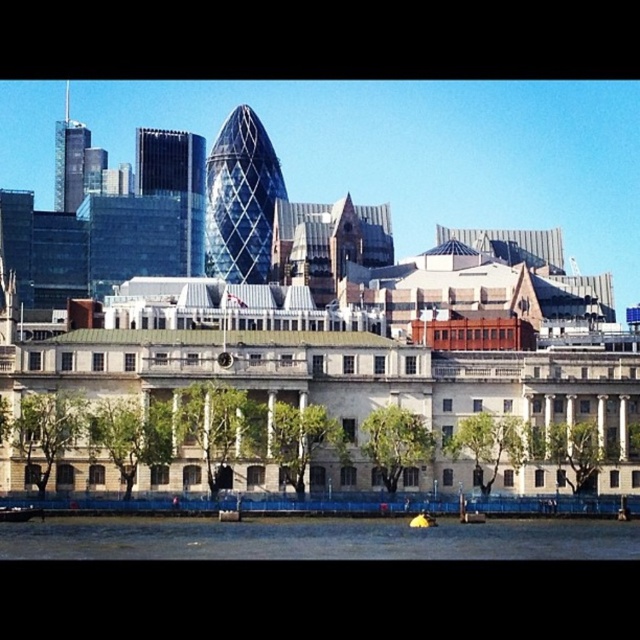
Question: Can you confirm if yellow rubber boat at lower left is smaller than yellow rubber boat at lower center?

Choices:
 (A) yes
 (B) no

Answer: (A)

Question: Among these points, which one is nearest to the camera?

Choices:
 (A) (422, 524)
 (B) (22, 515)

Answer: (A)

Question: Based on their relative distances, which object is nearer to the yellow rubber boat at lower left?

Choices:
 (A) yellow rubber boat at lower center
 (B) dark blue water at lower center

Answer: (B)

Question: Does dark blue water at lower center have a lesser width compared to yellow rubber boat at lower center?

Choices:
 (A) no
 (B) yes

Answer: (A)

Question: Does yellow rubber boat at lower left appear under yellow rubber boat at lower center?

Choices:
 (A) no
 (B) yes

Answer: (A)

Question: Estimate the real-world distances between objects in this image. Which object is farther from the dark blue water at lower center?

Choices:
 (A) yellow rubber boat at lower center
 (B) yellow rubber boat at lower left

Answer: (B)